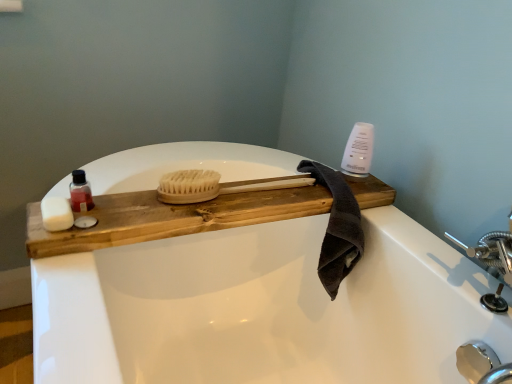
Find the location of a particular element. free area in between natural wood brush at center and white matte soap at left, marked as the 2th soap in a left-to-right arrangement is located at coordinates (157, 203).